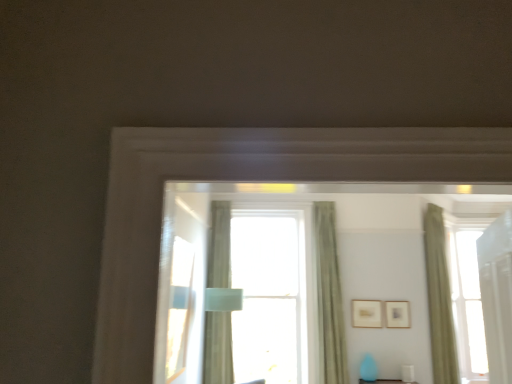
Question: Is matte gold picture frame at upper center, positioned as the 1th picture frame in right-to-left order, further to camera compared to wooden picture frame at upper right, the first picture frame when ordered from left to right?

Choices:
 (A) no
 (B) yes

Answer: (A)

Question: From the image's perspective, does matte gold picture frame at upper center, the 2th picture frame in the left-to-right sequence, appear higher than wooden picture frame at upper right, which is the 2th picture frame from right to left?

Choices:
 (A) yes
 (B) no

Answer: (B)

Question: Can you confirm if matte gold picture frame at upper center, the 2th picture frame in the left-to-right sequence, is taller than wooden picture frame at upper right, the first picture frame when ordered from left to right?

Choices:
 (A) yes
 (B) no

Answer: (B)

Question: Is matte gold picture frame at upper center, positioned as the 1th picture frame in right-to-left order, positioned with its back to wooden picture frame at upper right, which is the 2th picture frame from right to left?

Choices:
 (A) yes
 (B) no

Answer: (B)

Question: Is the position of matte gold picture frame at upper center, the 2th picture frame in the left-to-right sequence, less distant than that of wooden picture frame at upper right, the first picture frame when ordered from left to right?

Choices:
 (A) yes
 (B) no

Answer: (A)

Question: From a real-world perspective, is matte gold picture frame at upper center, positioned as the 1th picture frame in right-to-left order, physically above wooden picture frame at upper right, which is the 2th picture frame from right to left?

Choices:
 (A) no
 (B) yes

Answer: (A)

Question: From a real-world perspective, is matte gold picture frame at upper center, the 2th picture frame in the left-to-right sequence, on top of green fabric curtain at right, arranged as the third curtain when viewed from the left?

Choices:
 (A) no
 (B) yes

Answer: (A)

Question: Considering the relative positions of matte gold picture frame at upper center, the 2th picture frame in the left-to-right sequence, and green fabric curtain at right, acting as the 1th curtain starting from the right, in the image provided, is matte gold picture frame at upper center, the 2th picture frame in the left-to-right sequence, to the right of green fabric curtain at right, acting as the 1th curtain starting from the right, from the viewer's perspective?

Choices:
 (A) no
 (B) yes

Answer: (A)

Question: Is matte gold picture frame at upper center, the 2th picture frame in the left-to-right sequence, positioned with its back to green fabric curtain at right, acting as the 1th curtain starting from the right?

Choices:
 (A) yes
 (B) no

Answer: (B)

Question: Can you confirm if matte gold picture frame at upper center, the 2th picture frame in the left-to-right sequence, is thinner than green fabric curtain at right, acting as the 1th curtain starting from the right?

Choices:
 (A) no
 (B) yes

Answer: (B)

Question: Is green fabric curtain at right, arranged as the third curtain when viewed from the left, surrounded by matte gold picture frame at upper center, the 2th picture frame in the left-to-right sequence?

Choices:
 (A) yes
 (B) no

Answer: (B)

Question: Is matte gold picture frame at upper center, the 2th picture frame in the left-to-right sequence, to the left of green fabric curtain at right, acting as the 1th curtain starting from the right, from the viewer's perspective?

Choices:
 (A) yes
 (B) no

Answer: (A)

Question: Is silky green curtain at center, placed as the 3th curtain when sorted from right to left, closer to the viewer compared to matte gold picture frame at upper center, positioned as the 1th picture frame in right-to-left order?

Choices:
 (A) no
 (B) yes

Answer: (B)